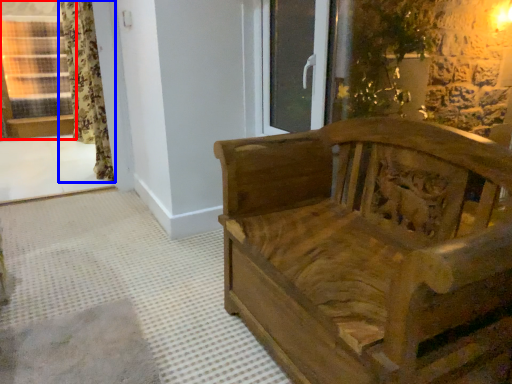
Question: Which object appears farthest to the camera in this image, window (highlighted by a red box) or curtain (highlighted by a blue box)?

Choices:
 (A) window
 (B) curtain

Answer: (B)